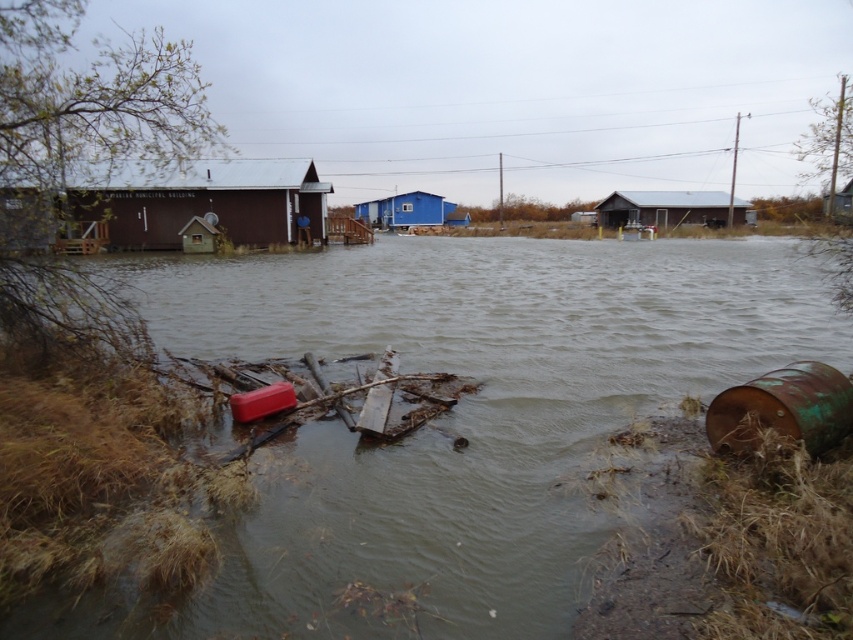
You are a rescue worker trying to navigate through the flooded area. You need to reach the brown wooden hut at left to check for survivors. Is the rusty metallic barrel at lower right blocking your path to the hut?

The brown wooden hut at left is located above the rusty metallic barrel at lower right, so the barrel is not blocking the path to the hut since it is positioned below the hut.

What are the coordinates of the brown muddy water at center in the image?

The coordinates of the brown muddy water at center are at point (456, 419).